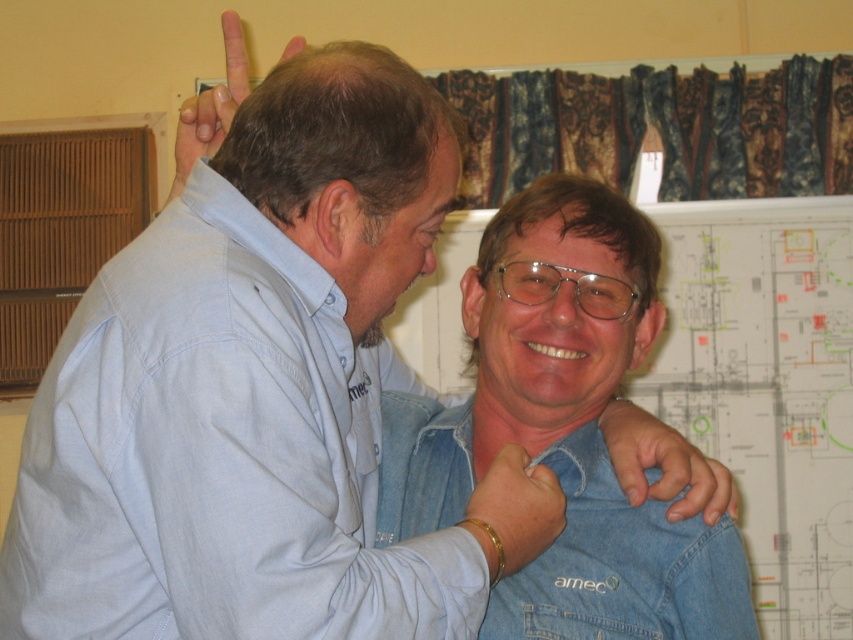
Can you confirm if gold bracelet at center is wider than matte skin at upper center?

In fact, gold bracelet at center might be narrower than matte skin at upper center.

What do you see at coordinates (514, 512) in the screenshot? I see `gold bracelet at center` at bounding box center [514, 512].

Find the location of a particular element. gold bracelet at center is located at coordinates (514, 512).

Consider the image. Can you confirm if smooth denim hand at center is positioned below matte skin at upper center?

Yes, smooth denim hand at center is below matte skin at upper center.

Who is taller, smooth denim hand at center or matte skin at upper center?

matte skin at upper center is taller.

Describe the element at coordinates (664, 465) in the screenshot. I see `smooth denim hand at center` at that location.

You are a GUI agent. You are given a task and a screenshot of the screen. Output one action in this format:
    pyautogui.click(x=<x>, y=<y>)
    Task: Click on the smooth denim hand at center
    
    Given the screenshot: What is the action you would take?
    pyautogui.click(x=664, y=465)

Describe the element at coordinates (664, 465) in the screenshot. I see `smooth denim hand at center` at that location.

Is smooth denim hand at center taller than gold bracelet at center?

Correct, smooth denim hand at center is much taller as gold bracelet at center.

Is point (659, 452) closer to camera compared to point (556, 497)?

No, (659, 452) is behind (556, 497).

Locate an element on the screen. The width and height of the screenshot is (853, 640). smooth denim hand at center is located at coordinates (664, 465).